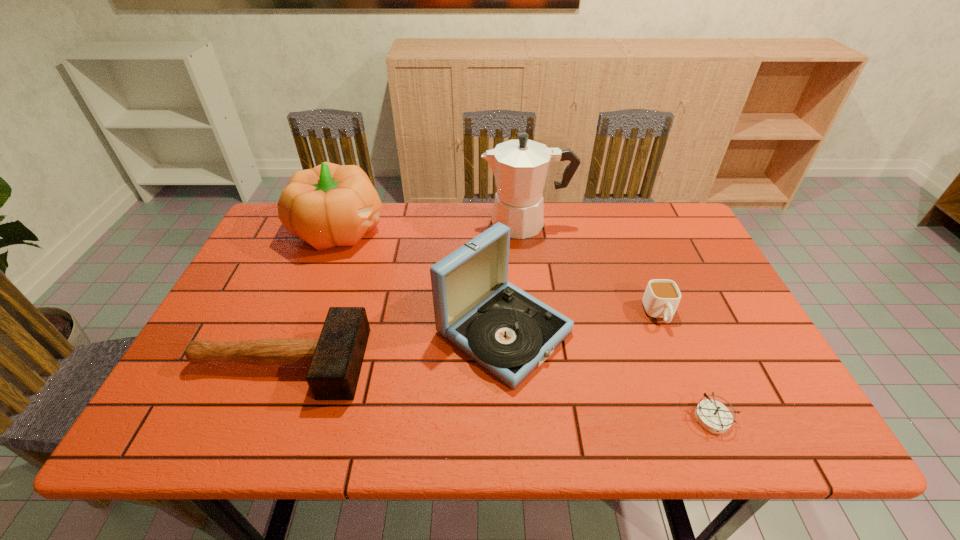
This screenshot has width=960, height=540. I want to click on free region located 0.150m on the left of the phonograph record, so click(x=374, y=332).

This screenshot has width=960, height=540. I want to click on free spot located 0.180m on the hammer head face of the mallet, so click(442, 363).

This screenshot has height=540, width=960. What are the coordinates of `vacant space located on the side with the handle of the cup` in the screenshot? It's located at (690, 392).

Identify the location of free region located on the back of the shortest object. Image resolution: width=960 pixels, height=540 pixels. point(696,377).

Image resolution: width=960 pixels, height=540 pixels. Identify the location of coffeepot that is at the far edge. (520, 167).

Locate an element on the screen. pumpkin that is at the far edge is located at coordinates (330, 205).

You are a GUI agent. You are given a task and a screenshot of the screen. Output one action in this format:
    pyautogui.click(x=<x>, y=<y>)
    Task: Click on the object at the near edge
    This screenshot has height=540, width=960.
    Given the screenshot: What is the action you would take?
    pyautogui.click(x=713, y=416)

You are a GUI agent. You are given a task and a screenshot of the screen. Output one action in this format:
    pyautogui.click(x=<x>, y=<y>)
    Task: Click on the pumpkin present at the left edge
    This screenshot has width=960, height=540.
    Given the screenshot: What is the action you would take?
    pyautogui.click(x=330, y=205)

Image resolution: width=960 pixels, height=540 pixels. What are the coordinates of `mallet at the left edge` in the screenshot? It's located at (335, 359).

Locate an element on the screen. object present at the right edge is located at coordinates (713, 416).